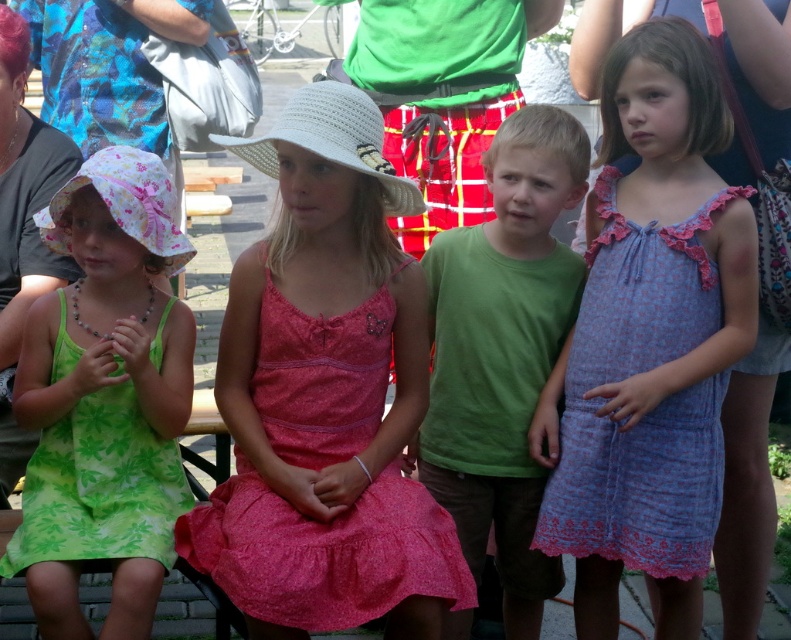
Is point (555, 536) farther from camera compared to point (40, 557)?

That is True.

Does blue floral fabric dress at right have a greater width compared to green floral fabric dress at left?

Correct, the width of blue floral fabric dress at right exceeds that of green floral fabric dress at left.

Locate an element on the screen. The height and width of the screenshot is (640, 791). blue floral fabric dress at right is located at coordinates (649, 406).

Is point (521, 148) behind point (679, 230)?

Yes, point (521, 148) is farther from viewer.

This screenshot has width=791, height=640. Describe the element at coordinates (502, 353) in the screenshot. I see `green cotton shirt at center` at that location.

Image resolution: width=791 pixels, height=640 pixels. Find the location of `green cotton shirt at center`. green cotton shirt at center is located at coordinates (502, 353).

Is pink satin dress at center shorter than green floral fabric dress at left?

In fact, pink satin dress at center may be taller than green floral fabric dress at left.

Is point (373, 371) positioned behind point (125, 470)?

Yes, point (373, 371) is farther from viewer.

Is point (248, 524) farther from viewer compared to point (116, 474)?

No, (248, 524) is closer to viewer.

Where is `pink satin dress at center`? pink satin dress at center is located at coordinates (324, 550).